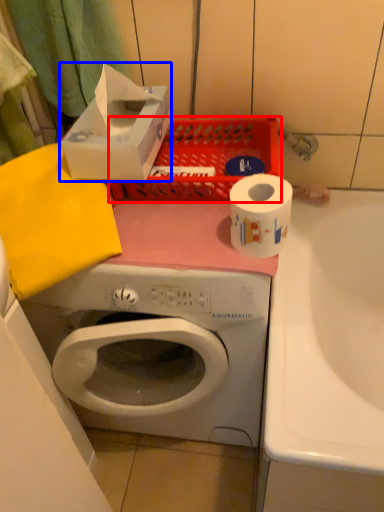
Question: Among these objects, which one is nearest to the camera, basket (highlighted by a red box) or storage box (highlighted by a blue box)?

Choices:
 (A) basket
 (B) storage box

Answer: (B)